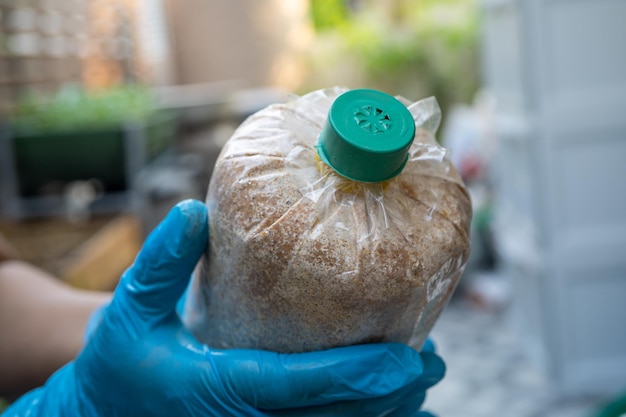
Image resolution: width=626 pixels, height=417 pixels. I want to click on plastic container, so click(x=337, y=261).